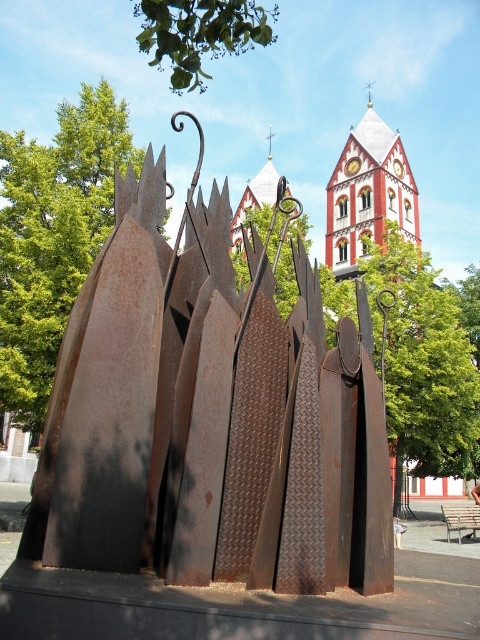
You are a photographer standing in the park and want to capture both the rusty metal sculpture at center and the brown wooden park bench at center in a single frame. Which object should you focus on first to ensure both are in the frame?

The rusty metal sculpture at center is taller than the brown wooden park bench at center, so you should focus on the rusty metal sculpture at center first to ensure both are in the frame.

You are standing in front of the modern sculpture and want to take a photo of the church tower. There are two points marked on your camera screen at coordinates point (305, 538) and point (447, 529). Which point is closer to you, and which one is farther away?

Point (305, 538) is closer to you than point (447, 529) because it is in front of the other point.

You are a visitor in the park and want to take a photo of the rusty metal sculpture at center and the brown wooden park bench at center. If you stand to the right of the bench, will the sculpture be to your left or right in the photo?

The rusty metal sculpture at center is positioned on the left side of brown wooden park bench at center. If you stand to the right of the brown wooden park bench at center, the rusty metal sculpture at center will be to your left in the photo.